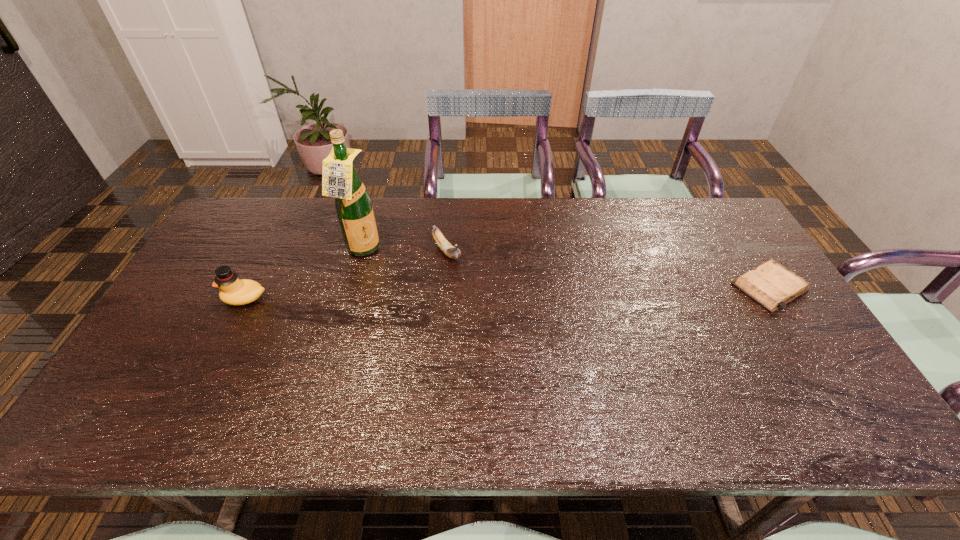
This screenshot has width=960, height=540. What are the coordinates of `vacant space situated on the front-facing side of the leftmost object` in the screenshot? It's located at click(189, 298).

This screenshot has height=540, width=960. In order to click on free region located 0.200m on the back of the diary in this screenshot , I will do `click(728, 223)`.

Where is `vacant space located at the stem of the third object from left to right`? vacant space located at the stem of the third object from left to right is located at coordinates (498, 321).

Identify the location of blank area located 0.140m at the stem of the third object from left to right. Image resolution: width=960 pixels, height=540 pixels. (477, 295).

At what (x,y) coordinates should I click in order to perform the action: click on vacant area situated 0.160m at the stem of the third object from left to right. Please return your answer as a coordinate pair (x, y). This screenshot has height=540, width=960. Looking at the image, I should click on (481, 300).

Where is `vacant space located 0.370m on the front-facing side of the liquor`? The image size is (960, 540). vacant space located 0.370m on the front-facing side of the liquor is located at coordinates (476, 305).

At what (x,y) coordinates should I click in order to perform the action: click on free space located 0.270m on the front-facing side of the liquor. Please return your answer as a coordinate pair (x, y). The width and height of the screenshot is (960, 540). Looking at the image, I should click on (447, 291).

Locate an element on the screen. This screenshot has height=540, width=960. vacant space located 0.240m on the front-facing side of the liquor is located at coordinates (439, 287).

Locate an element on the screen. The image size is (960, 540). banana that is at the far edge is located at coordinates (452, 252).

The image size is (960, 540). In order to click on liquor present at the far edge in this screenshot , I will do `click(340, 180)`.